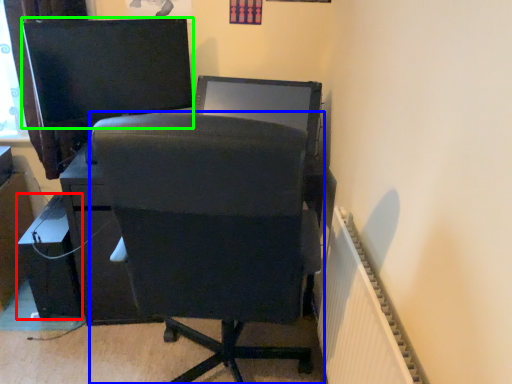
Question: Which object is positioned closest to furniture (highlighted by a red box)? Select from chair (highlighted by a blue box) and computer monitor (highlighted by a green box).

Choices:
 (A) chair
 (B) computer monitor

Answer: (B)